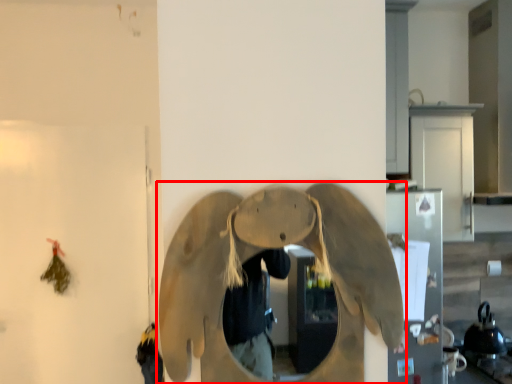
Question: From the image's perspective, considering the relative positions of elephant (annotated by the red box) and appliance in the image provided, where is elephant (annotated by the red box) located with respect to the staircase?

Choices:
 (A) above
 (B) below

Answer: (A)